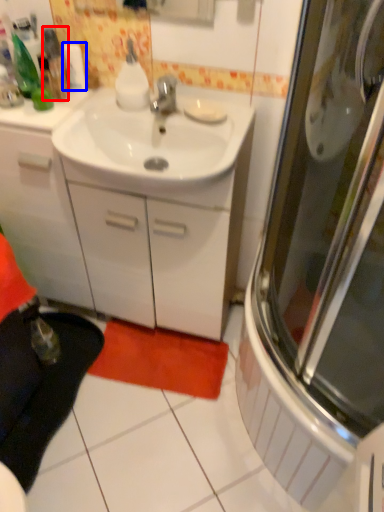
Question: Which of the following is the closest to the observer, bottle (highlighted by a red box) or toilet paper (highlighted by a blue box)?

Choices:
 (A) bottle
 (B) toilet paper

Answer: (A)